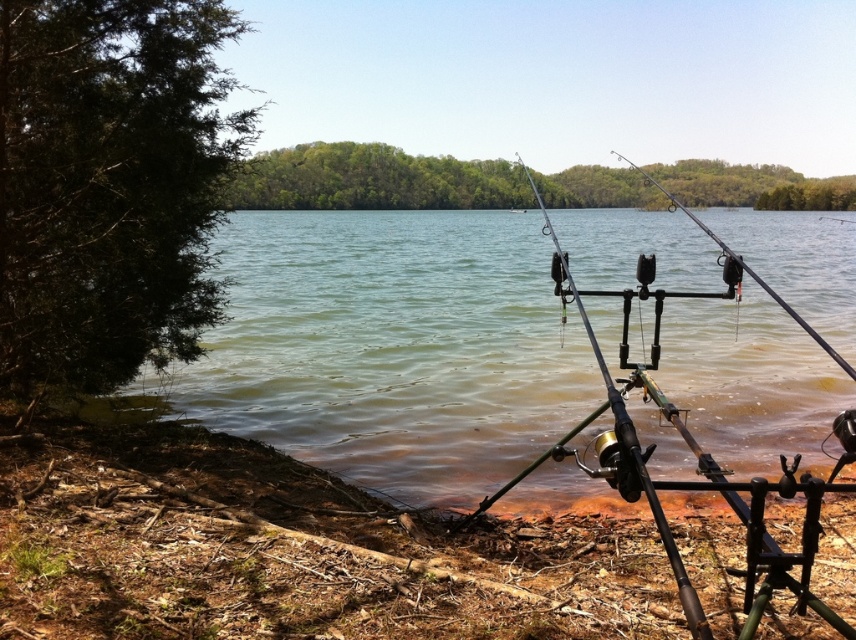
Question: Can you confirm if greenish water at center is positioned above metallic fishing pole at center?

Choices:
 (A) yes
 (B) no

Answer: (A)

Question: Is metallic fishing pole at center above black matte fishing pole at center?

Choices:
 (A) no
 (B) yes

Answer: (A)

Question: Which point is closer to the camera?

Choices:
 (A) [x=800, y=320]
 (B) [x=736, y=257]
 (C) [x=657, y=520]

Answer: (C)

Question: Does greenish water at center appear on the left side of brown dirt shoreline at lower left?

Choices:
 (A) yes
 (B) no

Answer: (B)

Question: Among these objects, which one is nearest to the camera?

Choices:
 (A) metallic fishing rod at center
 (B) greenish water at center
 (C) black matte fishing pole at center

Answer: (A)

Question: Based on their relative distances, which object is nearer to the metallic fishing pole at center?

Choices:
 (A) black matte fishing pole at center
 (B) metallic fishing rod at center

Answer: (B)